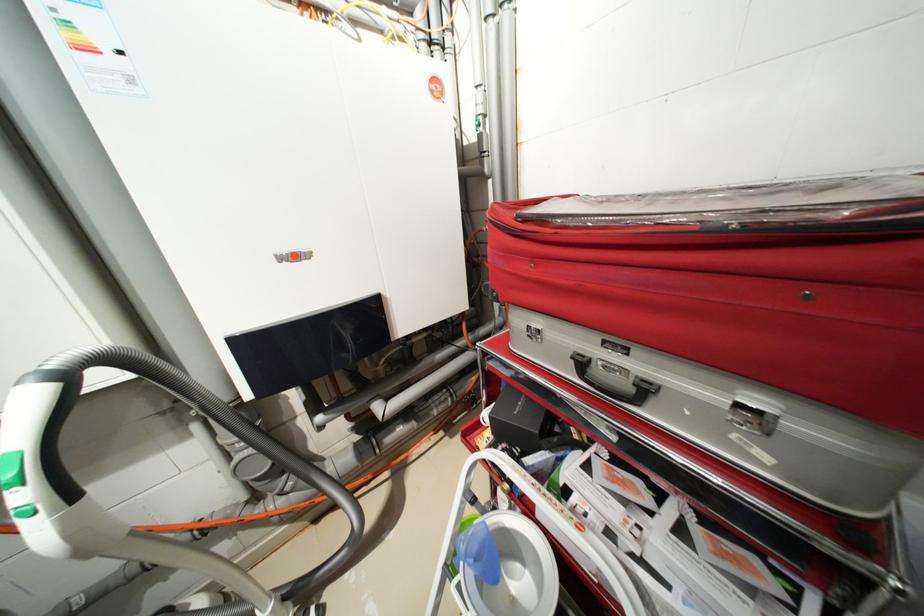
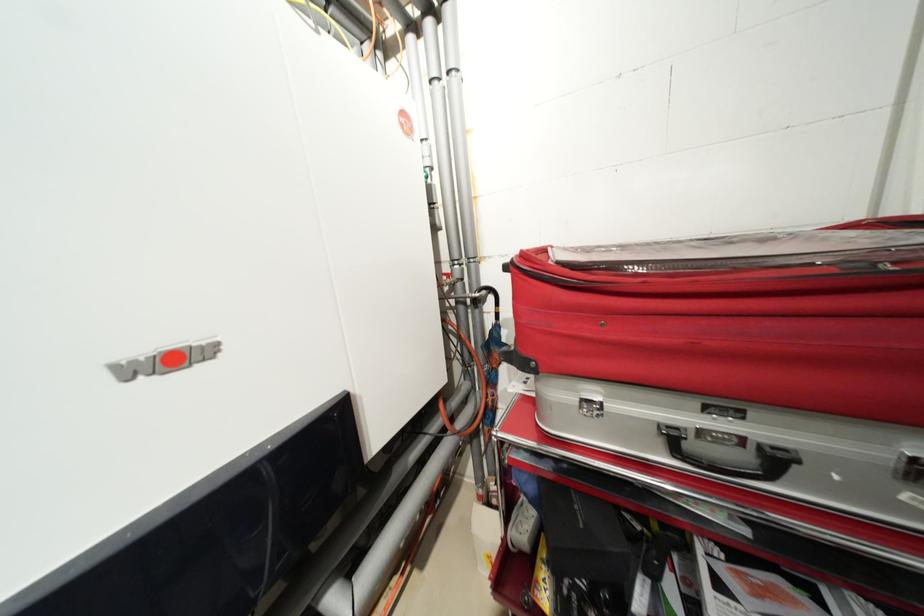
The images are taken continuously from a first-person perspective. In which direction are you moving?

The movement direction of the cameraman is left, forward.